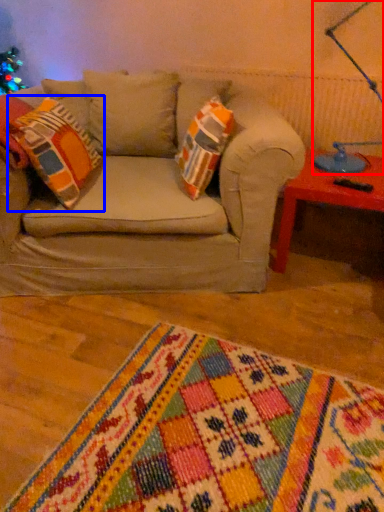
Question: Which of the following is the closest to the observer, table lamp (highlighted by a red box) or throw pillow (highlighted by a blue box)?

Choices:
 (A) table lamp
 (B) throw pillow

Answer: (B)